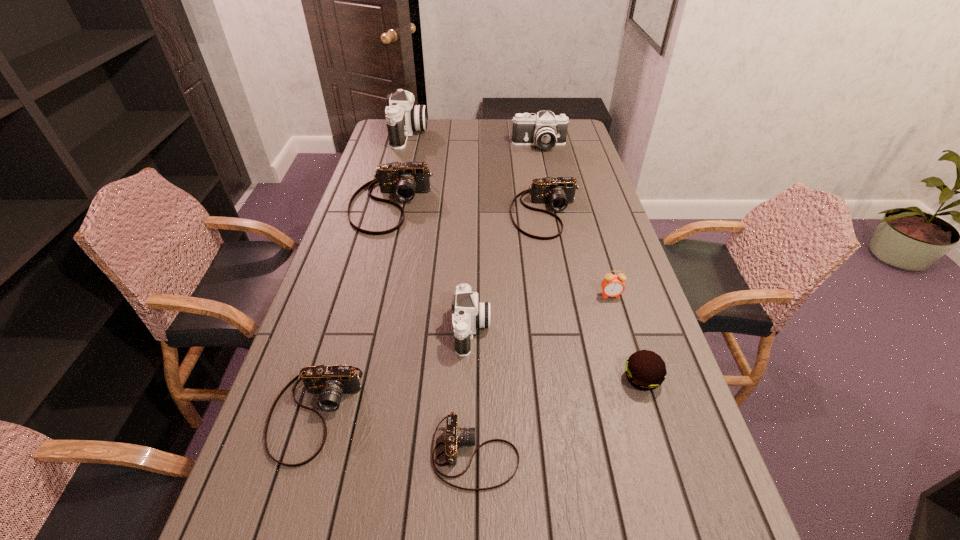
Where is `vacant space that's between the biggest brown camera and the second black camera from right to left`? This screenshot has width=960, height=540. vacant space that's between the biggest brown camera and the second black camera from right to left is located at coordinates (431, 267).

Find the location of a particular element. The width and height of the screenshot is (960, 540). vacant area that lies between the patty and the pink alarm clock is located at coordinates (626, 337).

Locate an element on the screen. free space between the smallest brown camera and the fifth nearest object is located at coordinates (543, 375).

Where is `free space between the second black camera from left to right and the rightmost brown camera`? free space between the second black camera from left to right and the rightmost brown camera is located at coordinates coord(509,272).

This screenshot has height=540, width=960. I want to click on vacant region between the leftmost black camera and the smallest brown camera, so click(442, 294).

Identify the location of vacant region between the biggest black camera and the patty. (525, 256).

At what (x,y) coordinates should I click in order to perform the action: click on vacant area between the patty and the biggest brown camera. Please return your answer as a coordinate pair (x, y). The image size is (960, 540). Looking at the image, I should click on (516, 292).

Find the location of a particular element. Image resolution: width=960 pixels, height=540 pixels. object that is the eighth closest to the tallest object is located at coordinates pos(454,436).

Find the location of `object that is the fourth closest to the biggest black camera`. object that is the fourth closest to the biggest black camera is located at coordinates (470, 314).

This screenshot has height=540, width=960. In order to click on camera that is the fourth closest to the pink alarm clock in this screenshot , I will do `click(404, 180)`.